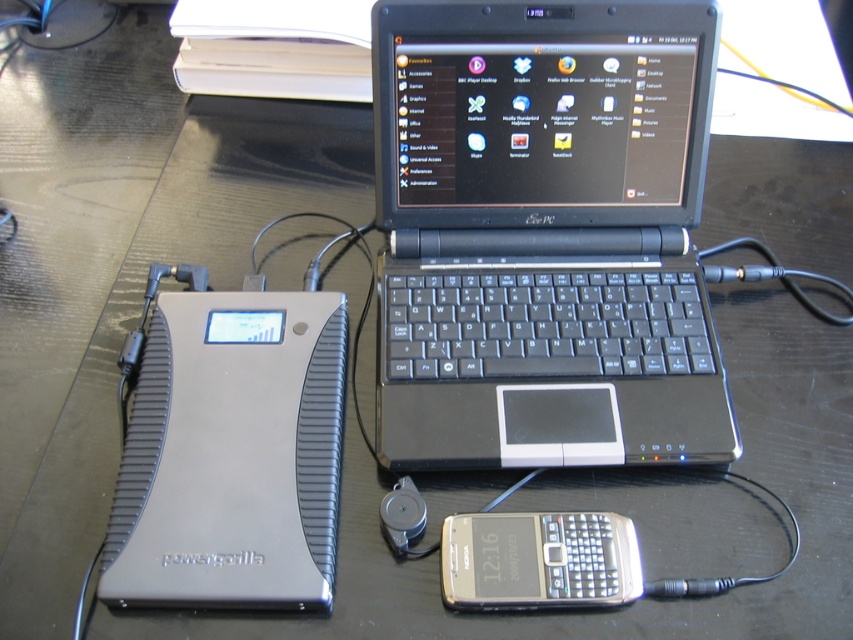
Question: Which point is closer to the camera taking this photo?

Choices:
 (A) (519, 547)
 (B) (332, 552)
 (C) (610, 445)

Answer: (A)

Question: Does silver metallic power bank at lower left have a smaller size compared to silver metallic smartphone at lower center?

Choices:
 (A) no
 (B) yes

Answer: (A)

Question: Does black plastic laptop at center have a greater width compared to silver metallic power bank at lower left?

Choices:
 (A) no
 (B) yes

Answer: (B)

Question: Which of the following is the closest to the observer?

Choices:
 (A) (642, 156)
 (B) (602, 564)
 (C) (294, 577)

Answer: (C)

Question: Which object appears closest to the camera in this image?

Choices:
 (A) silver metallic power bank at lower left
 (B) silver metallic smartphone at lower center

Answer: (A)

Question: Is silver metallic power bank at lower left wider than silver metallic smartphone at lower center?

Choices:
 (A) no
 (B) yes

Answer: (B)